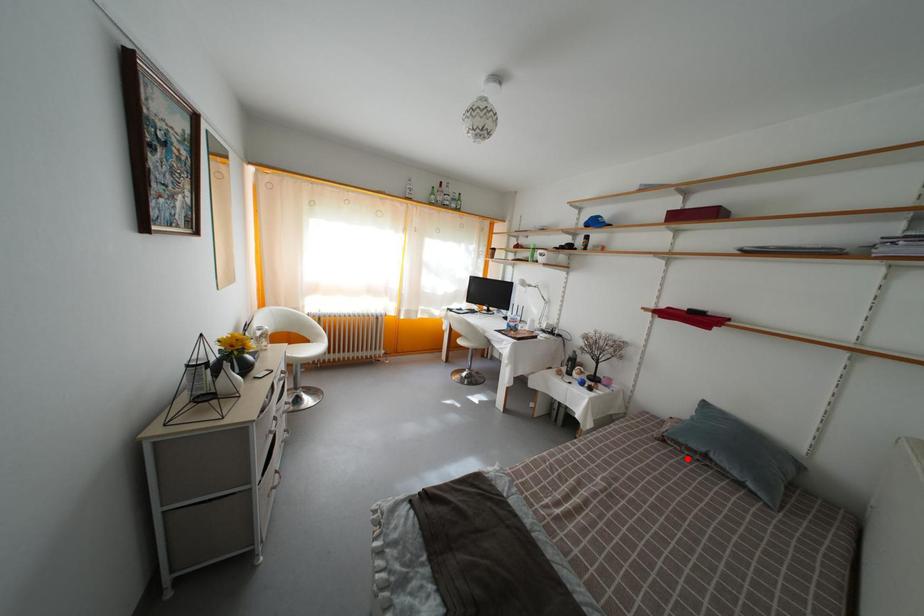
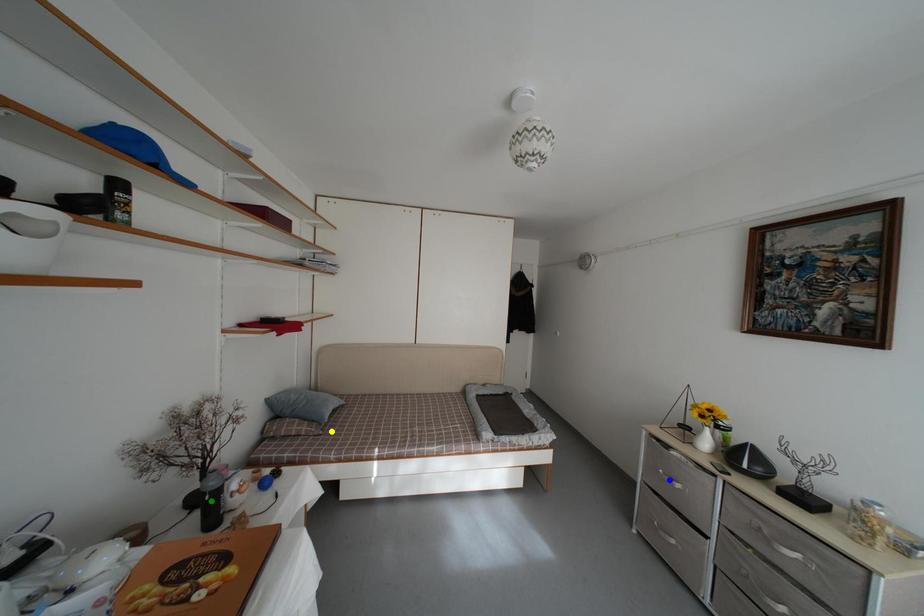
Question: I am providing you with two images of the same scene from different viewpoints. A red point is marked on the first image. You are given multiple points on the second image. Which mark in image 2 goes with the point in image 1?

Choices:
 (A) green point
 (B) yellow point
 (C) blue point

Answer: (B)